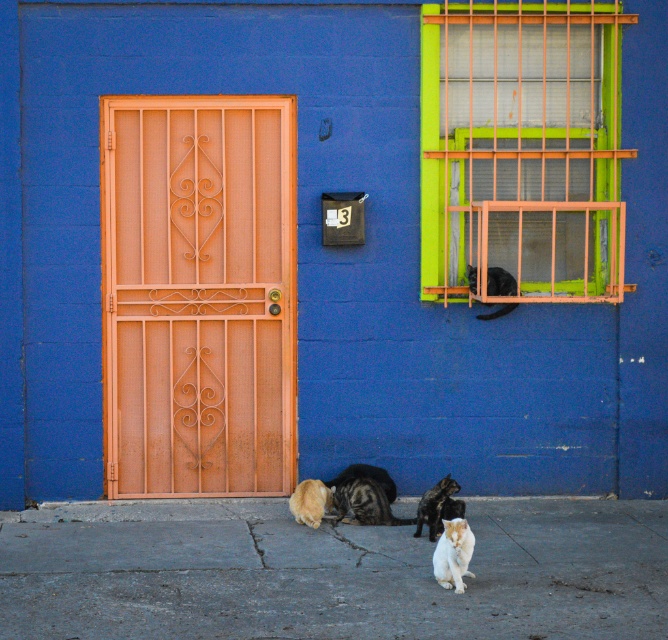
You are a delivery person trying to place a package on the ground between the gray concrete pavement at lower center and the rusty metal door at left. Can you fit the package there?

The gray concrete pavement at lower center is not as tall as the rusty metal door at left, meaning the pavement is lower. Since the package needs to be placed on the ground between them, the height difference allows space for the package to fit on the pavement area.

You are a delivery person trying to reach the mailbox on the wall. You see the rusty metal door at left and the white fluffy cat at lower center. Which object is closer to the mailbox?

The rusty metal door at left is positioned on the left side of the white fluffy cat at lower center, so the white fluffy cat at lower center is closer to the mailbox than the rusty metal door at left.

You are a delivery person trying to deliver a package to the house with the number 3 on the mailbox. You see the rusty metal door at left and the white fluffy cat at lower center. Which cat should you avoid stepping on to reach the mailbox?

You should avoid stepping on the white fluffy cat at lower center because it is behind the rusty metal door at left, making it closer to the delivery path towards the mailbox.